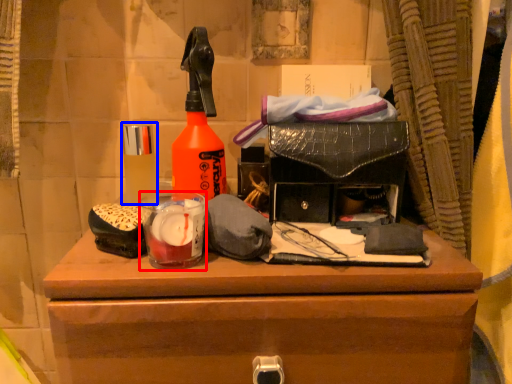
Question: Which of the following is the farthest to the observer, beverage (highlighted by a red box) or toiletry (highlighted by a blue box)?

Choices:
 (A) beverage
 (B) toiletry

Answer: (B)